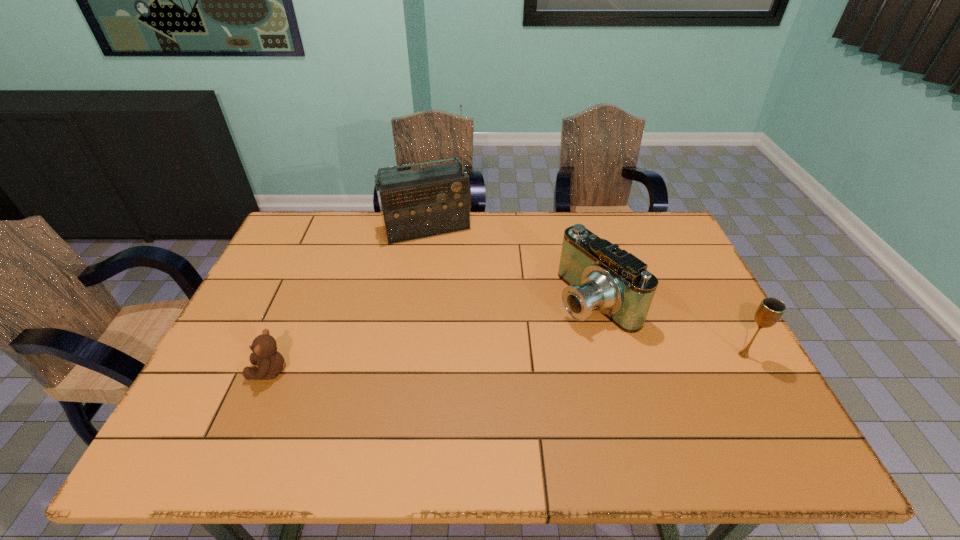
Locate an element on the screen. The image size is (960, 540). vacant point located between the second object from right to left and the teddy bear is located at coordinates (432, 335).

Locate an element on the screen. Image resolution: width=960 pixels, height=540 pixels. free point between the shortest object and the rightmost object is located at coordinates (507, 363).

Where is `free space between the leftmost object and the camcorder`? The height and width of the screenshot is (540, 960). free space between the leftmost object and the camcorder is located at coordinates (432, 335).

At what (x,y) coordinates should I click in order to perform the action: click on free spot between the shortest object and the tallest object. Please return your answer as a coordinate pair (x, y). This screenshot has width=960, height=540. Looking at the image, I should click on (348, 299).

At what (x,y) coordinates should I click in order to perform the action: click on free space that is in between the shortest object and the rightmost object. Please return your answer as a coordinate pair (x, y). The image size is (960, 540). Looking at the image, I should click on (507, 363).

This screenshot has width=960, height=540. What are the coordinates of `unoccupied position between the leftmost object and the rightmost object` in the screenshot? It's located at click(x=507, y=363).

Locate which object ranks in proximity to the second farthest object. Please provide its 2D coordinates. Your answer should be formatted as a tuple, i.e. [(x, y)], where the tuple contains the x and y coordinates of a point satisfying the conditions above.

[(770, 310)]

Select which object appears as the closest to the camcorder. Please provide its 2D coordinates. Your answer should be formatted as a tuple, i.e. [(x, y)], where the tuple contains the x and y coordinates of a point satisfying the conditions above.

[(770, 310)]

The height and width of the screenshot is (540, 960). What are the coordinates of `vacant space that satisfies the following two spatial constraints: 1. on the front side of the third object from right to left; 2. on the left side of the rightmost object` in the screenshot? It's located at pyautogui.click(x=407, y=355).

At what (x,y) coordinates should I click in order to perform the action: click on blank area in the image that satisfies the following two spatial constraints: 1. on the front side of the tallest object; 2. on the right side of the rightmost object. Please return your answer as a coordinate pair (x, y). The image size is (960, 540). Looking at the image, I should click on (407, 355).